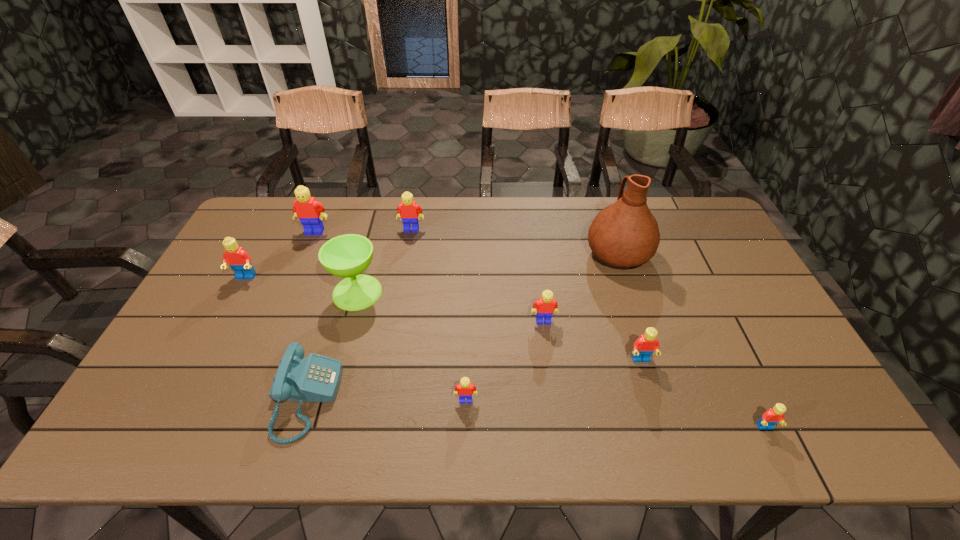
I want to click on vacant area that lies between the fifth nearest object and the third yellow Lego from left to right, so click(x=505, y=360).

Where is `free space that is in between the biggest red Lego and the second nearest red Lego`? The height and width of the screenshot is (540, 960). free space that is in between the biggest red Lego and the second nearest red Lego is located at coordinates (444, 319).

Identify the location of vacant area between the nearest red Lego and the second red Lego from right to left. The width and height of the screenshot is (960, 540). (703, 394).

Where is `free spot between the biggest yellow Lego and the smallest red Lego`? This screenshot has width=960, height=540. free spot between the biggest yellow Lego and the smallest red Lego is located at coordinates (540, 329).

The height and width of the screenshot is (540, 960). In order to click on vacant point located between the second Lego from right to left and the tallest object in this screenshot , I will do `click(630, 306)`.

The height and width of the screenshot is (540, 960). I want to click on unoccupied area between the third farthest Lego and the sixth Lego from left to right, so pos(444,319).

This screenshot has width=960, height=540. I want to click on empty location between the wineglass and the sixth object from right to left, so click(384, 261).

Locate an element on the screen. empty location between the second farthest red Lego and the blue telephone is located at coordinates (473, 380).

Image resolution: width=960 pixels, height=540 pixels. What are the coordinates of `object that ranks as the seventh closest to the fourth Lego from right to left` in the screenshot? It's located at (774, 415).

What are the coordinates of `object that stands as the sixth closest to the nearest Lego` in the screenshot? It's located at (347, 256).